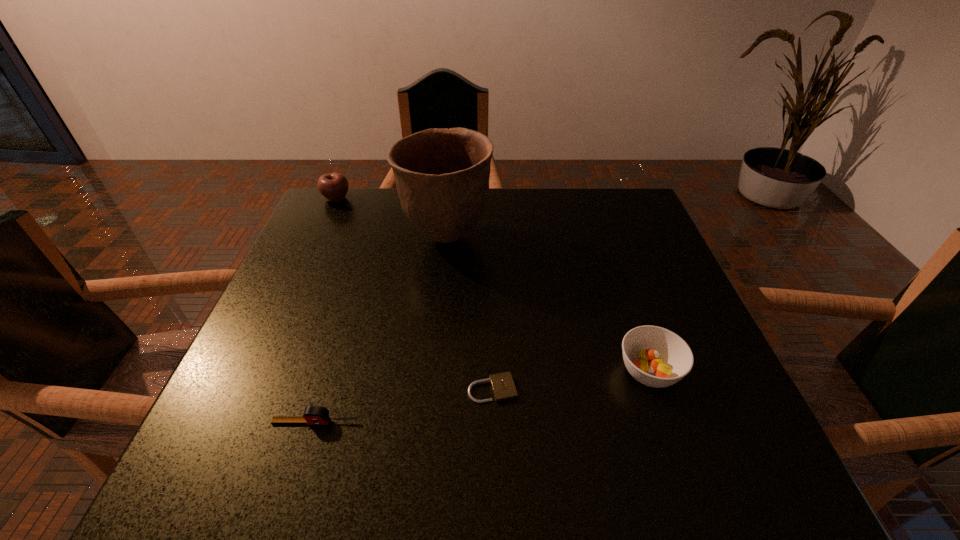
I want to click on blank region between the farthest object and the soup bowl, so click(x=492, y=285).

Where is `vacant region between the shortest object and the tallest object`? The image size is (960, 540). vacant region between the shortest object and the tallest object is located at coordinates (469, 313).

The width and height of the screenshot is (960, 540). I want to click on free space between the padlock and the second farthest object, so click(469, 313).

Locate an element on the screen. The height and width of the screenshot is (540, 960). vacant area that lies between the nearest object and the second farthest object is located at coordinates (381, 329).

Identify the location of vacant space in between the soup bowl and the second object from left to right. This screenshot has height=540, width=960. (482, 396).

This screenshot has height=540, width=960. I want to click on free space between the third tallest object and the nearest object, so click(482, 396).

The height and width of the screenshot is (540, 960). Identify the location of free space between the soup bowl and the tape measure. (482, 396).

Where is `object identified as the third closest to the fourth shortest object`? The width and height of the screenshot is (960, 540). object identified as the third closest to the fourth shortest object is located at coordinates 502,384.

You are a GUI agent. You are given a task and a screenshot of the screen. Output one action in this format:
    pyautogui.click(x=<x>, y=<y>)
    Task: Click on the object that can be found as the closest to the rightmost object
    The image size is (960, 540).
    Given the screenshot: What is the action you would take?
    pyautogui.click(x=502, y=384)

You are a GUI agent. You are given a task and a screenshot of the screen. Output one action in this format:
    pyautogui.click(x=<x>, y=<y>)
    Task: Click on the free space in the image that satisfies the following two spatial constraints: 1. on the side of the leftmost object with the unique marking; 2. on the left side of the fourth nearest object
    Image resolution: width=960 pixels, height=540 pixels.
    Given the screenshot: What is the action you would take?
    pyautogui.click(x=319, y=237)